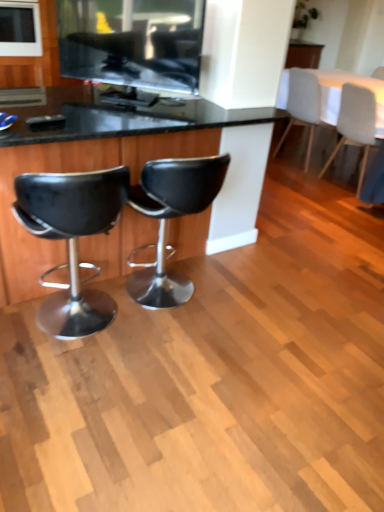
Question: From a real-world perspective, is white glossy microwave at upper left, the 1th appliance viewed from the back, above or below black leather desk at center?

Choices:
 (A) below
 (B) above

Answer: (B)

Question: Based on their sizes in the image, would you say white glossy microwave at upper left, which appears as the first appliance when viewed from the left, is bigger or smaller than black leather desk at center?

Choices:
 (A) big
 (B) small

Answer: (B)

Question: Considering the real-world distances, which object is closest to the white fabric table at upper right?

Choices:
 (A) black leather stool at center, positioned as the 2th chair in left-to-right order
 (B) white glossy microwave at upper left, the second appliance viewed from the front
 (C) matte black tv at upper center, the first appliance when ordered from bottom to top
 (D) black leather desk at center
 (E) white fabric chair at upper right, arranged as the second chair when viewed from the right

Answer: (E)

Question: Which object is the closest to the black leather stool at center, positioned as the third chair in right-to-left order?

Choices:
 (A) white fabric chair at upper right, the first chair from the back
 (B) white glossy microwave at upper left, the 2th appliance ordered from the bottom
 (C) white fabric table at upper right
 (D) white fabric chair at upper right, the second chair positioned from the back
 (E) black leather stool at left, the fourth chair from the right

Answer: (E)